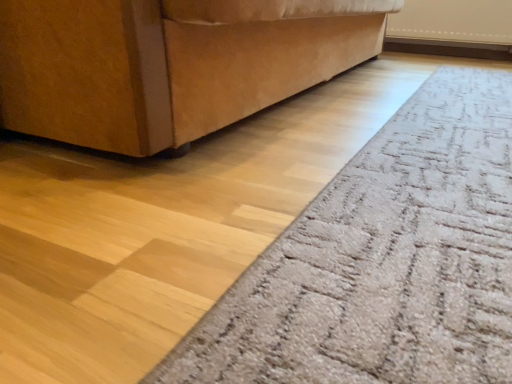
The width and height of the screenshot is (512, 384). What do you see at coordinates (383, 260) in the screenshot? I see `beige textured mat at lower right` at bounding box center [383, 260].

Find the location of a particular element. This screenshot has width=512, height=384. beige textured mat at lower right is located at coordinates (383, 260).

Measure the distance between point (510, 375) and camera.

Point (510, 375) is 13.15 inches from camera.

This screenshot has width=512, height=384. In order to click on beige textured mat at lower right in this screenshot , I will do `click(383, 260)`.